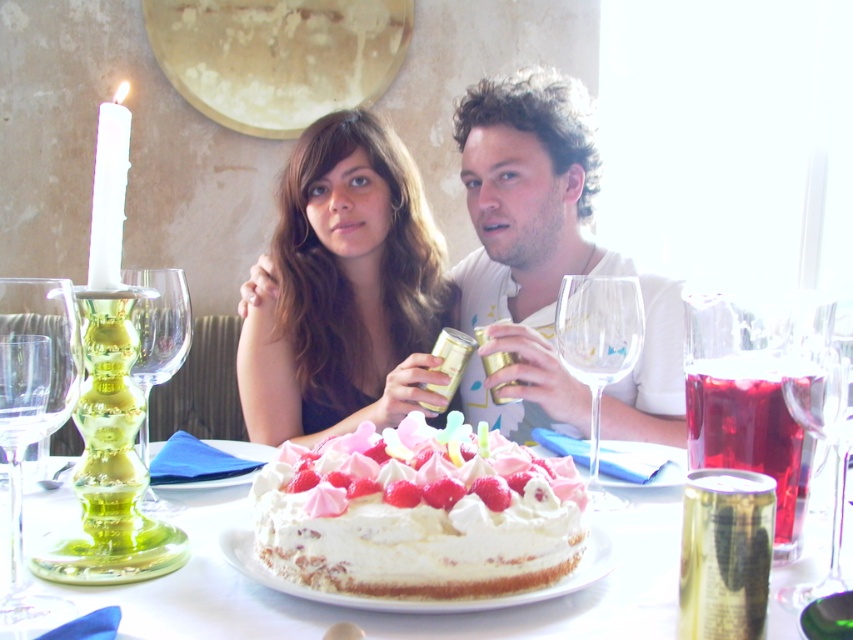
Is matte black dress at center above transparent glass wine glass at left?

Indeed, matte black dress at center is positioned over transparent glass wine glass at left.

Locate an element on the screen. The width and height of the screenshot is (853, 640). matte black dress at center is located at coordinates (345, 289).

Does matte black dress at center appear under white frosted cake at center?

No, matte black dress at center is not below white frosted cake at center.

Describe the element at coordinates (345, 289) in the screenshot. I see `matte black dress at center` at that location.

Is point (425, 307) positioned after point (407, 624)?

Yes.

Identify the location of matte black dress at center. The width and height of the screenshot is (853, 640). (x=345, y=289).

Does white matte wine glass at upper center have a larger size compared to white wax candle at left?

Yes.

What do you see at coordinates (549, 266) in the screenshot?
I see `white matte wine glass at upper center` at bounding box center [549, 266].

Does point (602, 262) come behind point (90, 259)?

Yes, it is behind point (90, 259).

This screenshot has height=640, width=853. I want to click on white matte wine glass at upper center, so click(549, 266).